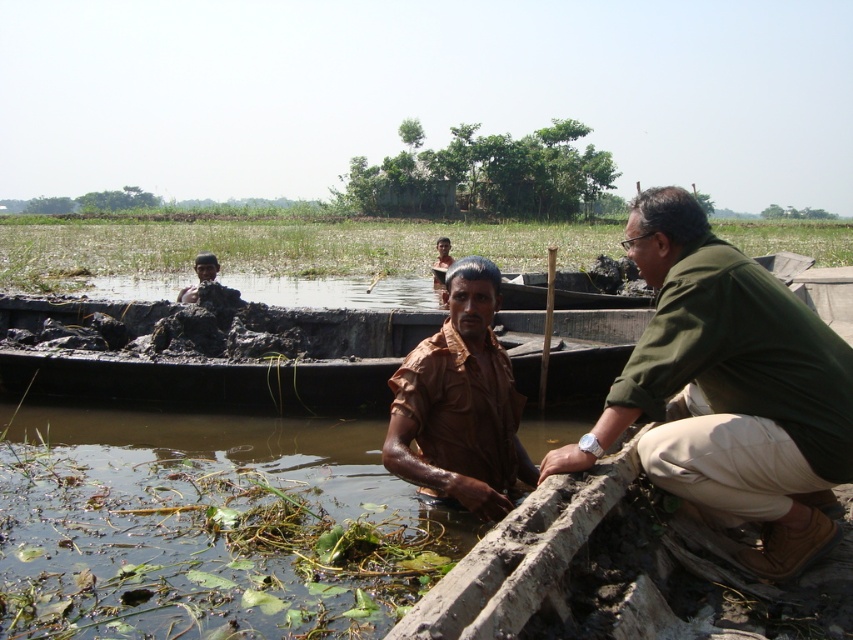
Question: Does brown matte shirt at center appear on the left side of brown matte head at upper left?

Choices:
 (A) yes
 (B) no

Answer: (B)

Question: Based on their relative distances, which object is farther from the dark brown mud at center?

Choices:
 (A) brown matte head at upper left
 (B) brown matte shirt at center
 (C) green fabric shirt at right

Answer: (C)

Question: Is green fabric shirt at right smaller than brown matte head at upper left?

Choices:
 (A) yes
 (B) no

Answer: (A)

Question: Which point is closer to the camera taking this photo?

Choices:
 (A) (73, 307)
 (B) (209, 280)
 (C) (426, 490)

Answer: (C)

Question: Is green fabric shirt at right above brown matte head at upper left?

Choices:
 (A) no
 (B) yes

Answer: (A)

Question: Among these objects, which one is farthest from the camera?

Choices:
 (A) green fabric shirt at right
 (B) dark brown mud at center
 (C) brown matte head at upper left

Answer: (C)